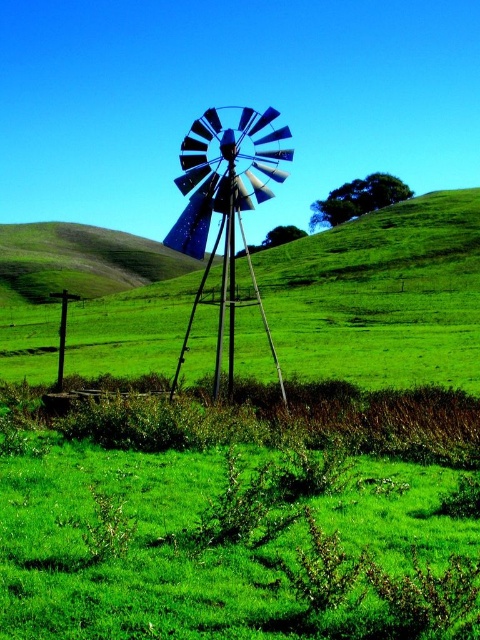
Between metallic windmill at center and green grassy hillside at center, which one is positioned lower?

metallic windmill at center

Where is `metallic windmill at center`? The image size is (480, 640). metallic windmill at center is located at coordinates (382, 296).

Identify the location of metallic windmill at center. The image size is (480, 640). (382, 296).

Can you confirm if metallic windmill at center is positioned below blue metallic windmill at center?

Actually, metallic windmill at center is above blue metallic windmill at center.

Does point (455, 220) come behind point (216, 392)?

That is True.

I want to click on metallic windmill at center, so click(382, 296).

You are a GUI agent. You are given a task and a screenshot of the screen. Output one action in this format:
    pyautogui.click(x=<x>, y=<y>)
    Task: Click on the metallic windmill at center
    
    Given the screenshot: What is the action you would take?
    pyautogui.click(x=382, y=296)

Between blue metallic windmill at center and green grassy hillside at center, which one appears on the left side from the viewer's perspective?

green grassy hillside at center is more to the left.

Who is more forward, (231, 280) or (74, 259)?

Point (231, 280) is in front.

The width and height of the screenshot is (480, 640). In order to click on blue metallic windmill at center in this screenshot , I will do `click(223, 216)`.